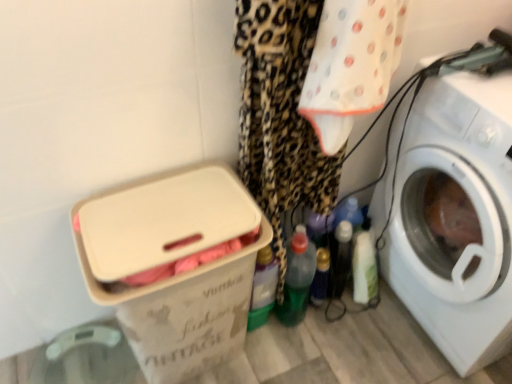
Question: In which direction should I rotate to look at green translucent bottle at center, which is the 1th bottle from left to right?

Choices:
 (A) left
 (B) right

Answer: (B)

Question: Considering the relative sizes of green plastic bottle at center, which is counted as the second bottle, starting from the right, and green translucent bottle at center, arranged as the 3th bottle when viewed from the right, in the image provided, is green plastic bottle at center, which is counted as the second bottle, starting from the right, taller than green translucent bottle at center, arranged as the 3th bottle when viewed from the right,?

Choices:
 (A) no
 (B) yes

Answer: (B)

Question: Is green plastic bottle at center, arranged as the 2th bottle when viewed from the left, at the right side of green translucent bottle at center, arranged as the 3th bottle when viewed from the right?

Choices:
 (A) yes
 (B) no

Answer: (A)

Question: Is green plastic bottle at center, which is counted as the second bottle, starting from the right, closer to camera compared to green translucent bottle at center, which is the 1th bottle from left to right?

Choices:
 (A) no
 (B) yes

Answer: (A)

Question: Is green plastic bottle at center, arranged as the 2th bottle when viewed from the left, outside of green translucent bottle at center, which is the 1th bottle from left to right?

Choices:
 (A) yes
 (B) no

Answer: (A)

Question: From the image's perspective, is green plastic bottle at center, which is counted as the second bottle, starting from the right, beneath green translucent bottle at center, arranged as the 3th bottle when viewed from the right?

Choices:
 (A) yes
 (B) no

Answer: (A)

Question: Would you say green plastic bottle at center, arranged as the 2th bottle when viewed from the left, contains green translucent bottle at center, which is the 1th bottle from left to right?

Choices:
 (A) yes
 (B) no

Answer: (B)

Question: Is the position of green translucent bottle at center, which is the 1th bottle from left to right, more distant than that of green plastic bottle at center, which is counted as the second bottle, starting from the right?

Choices:
 (A) no
 (B) yes

Answer: (A)

Question: Can you see green translucent bottle at center, which is the 1th bottle from left to right, touching green plastic bottle at center, arranged as the 2th bottle when viewed from the left?

Choices:
 (A) no
 (B) yes

Answer: (B)

Question: From a real-world perspective, is green translucent bottle at center, which is the 1th bottle from left to right, located higher than green plastic bottle at center, arranged as the 2th bottle when viewed from the left?

Choices:
 (A) yes
 (B) no

Answer: (A)

Question: Does green translucent bottle at center, which is the 1th bottle from left to right, have a larger size compared to green plastic bottle at center, arranged as the 2th bottle when viewed from the left?

Choices:
 (A) yes
 (B) no

Answer: (B)

Question: Is green translucent bottle at center, arranged as the 3th bottle when viewed from the right, taller than green plastic bottle at center, arranged as the 2th bottle when viewed from the left?

Choices:
 (A) no
 (B) yes

Answer: (A)

Question: Is the depth of green translucent bottle at center, arranged as the 3th bottle when viewed from the right, less than that of green plastic bottle at center, arranged as the 2th bottle when viewed from the left?

Choices:
 (A) no
 (B) yes

Answer: (B)

Question: Is white plastic box at lower left thinner than white plastic washing machine at right?

Choices:
 (A) yes
 (B) no

Answer: (A)